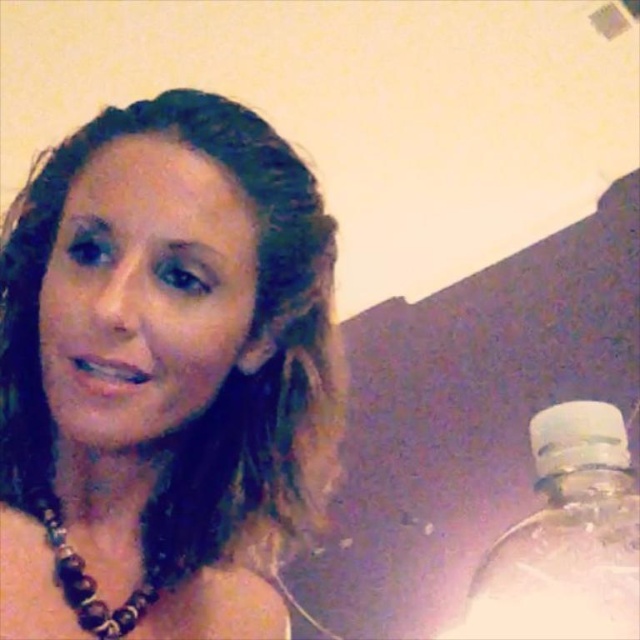
Question: Among these points, which one is farthest from the camera?

Choices:
 (A) (48, 529)
 (B) (76, 468)
 (C) (488, 556)

Answer: (C)

Question: Which point is farther from the camera taking this photo?

Choices:
 (A) (208, 545)
 (B) (60, 547)

Answer: (A)

Question: Which of these objects is positioned closest to the clear plastic bottle at lower right?

Choices:
 (A) brown beaded necklace at center
 (B) brown beaded necklace at lower left

Answer: (A)

Question: Is clear plastic bottle at lower right thinner than brown beaded necklace at lower left?

Choices:
 (A) no
 (B) yes

Answer: (A)

Question: Does brown beaded necklace at center appear under brown beaded necklace at lower left?

Choices:
 (A) yes
 (B) no

Answer: (B)

Question: Is brown beaded necklace at center bigger than brown beaded necklace at lower left?

Choices:
 (A) yes
 (B) no

Answer: (A)